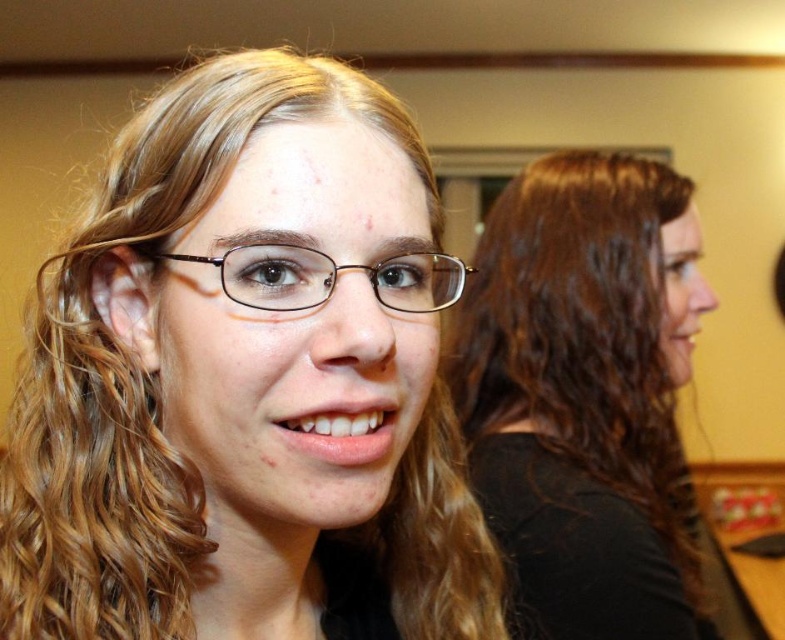
You are an artist trying to sketch this scene. You want to ensure the proportions are correct. Which object should you draw first, the dark brown hair at upper right or the brown plastic glasses at center, based on their size?

The dark brown hair at upper right is much taller than the brown plastic glasses at center, so you should draw the dark brown hair at upper right first to establish the scale before adding smaller details like the brown plastic glasses at center.

You are an artist trying to sketch the scene. You need to place the matte black hair at center and dark brown hair at upper right correctly. Which one should you draw first in your sketch to ensure proper layering?

The matte black hair at center should be drawn first because it is located above the dark brown hair at upper right, meaning it should be placed on top in the layering.

Looking at this image, you are a photographer setting up for a group photo in the classroom. You need to ensure that the dark brown hair at upper right and the brown plastic glasses at center are both in focus. Given that your camera can only focus on objects within a 50 cm range, will both objects be in focus?

The dark brown hair at upper right is 63.67 centimeters from the brown plastic glasses at center. Since the distance between them exceeds the camera focus range of 50 cm, both objects cannot be in focus simultaneously.